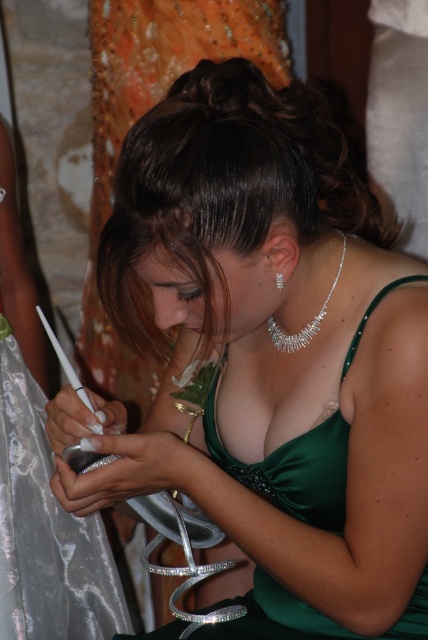
Is silver metallic dress at lower left closer to camera compared to silver metallic necklace at center?

No, it is not.

Can you confirm if silver metallic dress at lower left is positioned below silver metallic necklace at center?

Yes, silver metallic dress at lower left is below silver metallic necklace at center.

Find the location of a particular element. silver metallic dress at lower left is located at coordinates (45, 529).

You are a GUI agent. You are given a task and a screenshot of the screen. Output one action in this format:
    pyautogui.click(x=<x>, y=<y>)
    Task: Click on the silver metallic dress at lower left
    This screenshot has width=428, height=640.
    Given the screenshot: What is the action you would take?
    pyautogui.click(x=45, y=529)